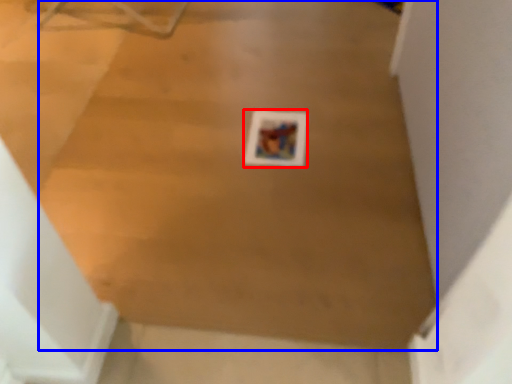
Question: Which object is closer to the camera taking this photo, print (highlighted by a red box) or plywood (highlighted by a blue box)?

Choices:
 (A) print
 (B) plywood

Answer: (B)